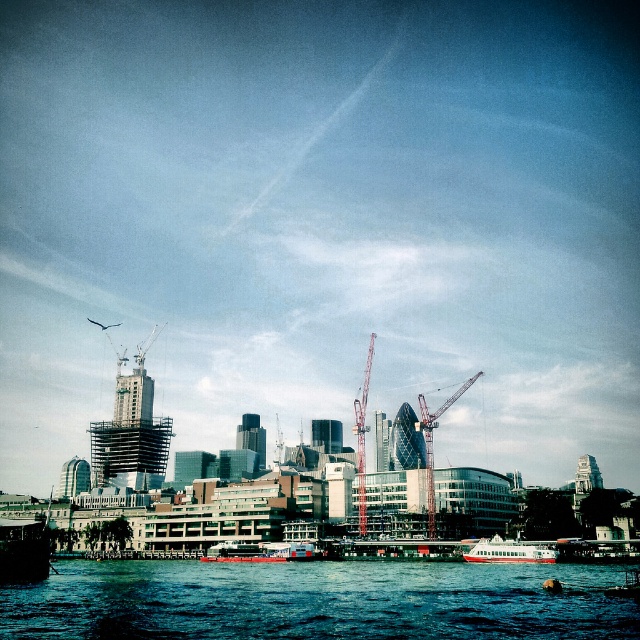
You are a photographer standing at the waterfront. You want to capture both the metallic boat at lower left and the metallic red crane at center in a single shot. Which object will appear larger in your photo?

The metallic red crane at center will appear larger in the photo because it is larger than the metallic boat at lower left.

You are a photographer standing at the waterfront. You want to capture a photo of the metallic construction crane at center without including the metallic silver boat at lower right in the frame. Based on their positions, is this possible?

The metallic construction crane at center is to the right of the metallic silver boat at lower right. Since the boat is positioned to the left of the crane, you can aim your camera to the right side of the boat to capture the crane without including the boat in the frame.